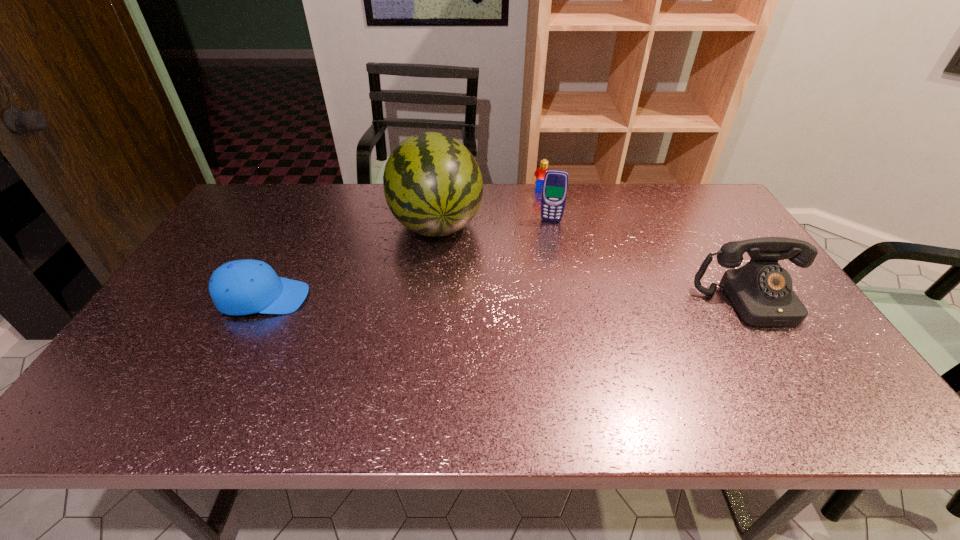
Where is `cap`? This screenshot has width=960, height=540. cap is located at coordinates (241, 287).

This screenshot has width=960, height=540. What are the coordinates of `the rightmost object` in the screenshot? It's located at (761, 291).

The width and height of the screenshot is (960, 540). In order to click on Lego in this screenshot , I will do `click(540, 173)`.

The image size is (960, 540). What are the coordinates of `watermelon` in the screenshot? It's located at (433, 186).

The height and width of the screenshot is (540, 960). Identify the location of the fourth object from right to left. (433, 186).

Find the location of a particular element. cellular telephone is located at coordinates (555, 185).

You are a GUI agent. You are given a task and a screenshot of the screen. Output one action in this format:
    pyautogui.click(x=<x>, y=<y>)
    Task: Click on the vacant region located on the front-facing side of the leftmost object
    The image size is (960, 540).
    Given the screenshot: What is the action you would take?
    click(369, 298)

Locate an element on the screen. The height and width of the screenshot is (540, 960). free region located 0.150m on the dial of the rightmost object is located at coordinates (801, 379).

You are a GUI agent. You are given a task and a screenshot of the screen. Output one action in this format:
    pyautogui.click(x=<x>, y=<y>)
    Task: Click on the free space located on the front-facing side of the farthest object
    This screenshot has height=540, width=960.
    Given the screenshot: What is the action you would take?
    pyautogui.click(x=531, y=214)

At what (x,y) coordinates should I click in order to perform the action: click on vacant region located 0.160m on the front-facing side of the farthest object. Please return your answer as a coordinate pair (x, y). The image size is (960, 540). Looking at the image, I should click on point(530,217).